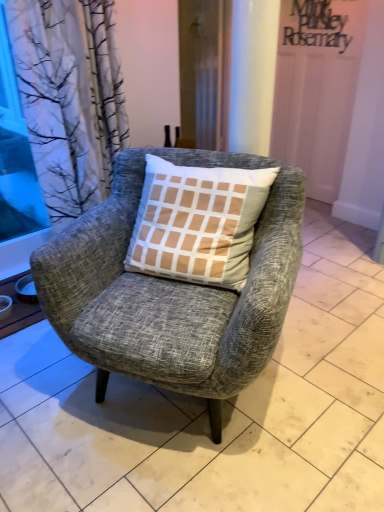
Question: Based on their positions, is wooden screen door at center located to the left or right of matte wood window sill at lower left?

Choices:
 (A) right
 (B) left

Answer: (A)

Question: Considering their positions, is wooden screen door at center located in front of or behind matte wood window sill at lower left?

Choices:
 (A) behind
 (B) front

Answer: (A)

Question: Considering the real-world distances, which object is closest to the wooden screen door at center?

Choices:
 (A) matte wood window sill at lower left
 (B) transparent glass window screen at left
 (C) textured gray armchair at center

Answer: (C)

Question: Which object is positioned farthest from the textured gray armchair at center?

Choices:
 (A) transparent glass window screen at left
 (B) matte wood window sill at lower left
 (C) wooden screen door at center

Answer: (A)